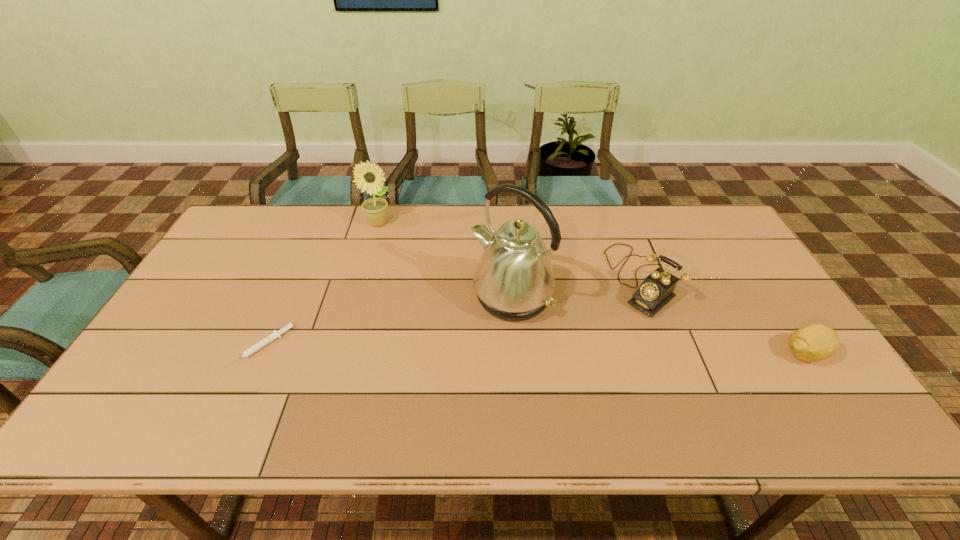
In the image, there is a desktop. Identify the location of vacant space at the far left corner. This screenshot has height=540, width=960. (276, 232).

Locate an element on the screen. The width and height of the screenshot is (960, 540). vacant area between the sunflower and the tallest object is located at coordinates (445, 260).

You are a GUI agent. You are given a task and a screenshot of the screen. Output one action in this format:
    pyautogui.click(x=<x>, y=<y>)
    Task: Click on the empty location between the farthest object and the leftmost object
    The image size is (960, 540).
    Given the screenshot: What is the action you would take?
    pyautogui.click(x=321, y=285)

At what (x,y) coordinates should I click in order to perform the action: click on vacant point located between the tallest object and the shortest object. Please return your answer as a coordinate pair (x, y). This screenshot has width=960, height=540. Looking at the image, I should click on (388, 322).

Where is `free space that is in between the shortest object and the third shortest object`? free space that is in between the shortest object and the third shortest object is located at coordinates (452, 313).

Where is `free space between the kettle and the second shortest object`? The height and width of the screenshot is (540, 960). free space between the kettle and the second shortest object is located at coordinates (659, 325).

Identify the location of free space between the second tallest object and the lemon. Image resolution: width=960 pixels, height=540 pixels. (591, 288).

Locate an element on the screen. Image resolution: width=960 pixels, height=540 pixels. unoccupied position between the leftmost object and the rightmost object is located at coordinates (534, 350).

Where is `vacant area that lies between the third shortest object and the rightmost object`? vacant area that lies between the third shortest object and the rightmost object is located at coordinates (724, 316).

Where is `free spot between the third shortest object and the lemon`? free spot between the third shortest object and the lemon is located at coordinates (724, 316).